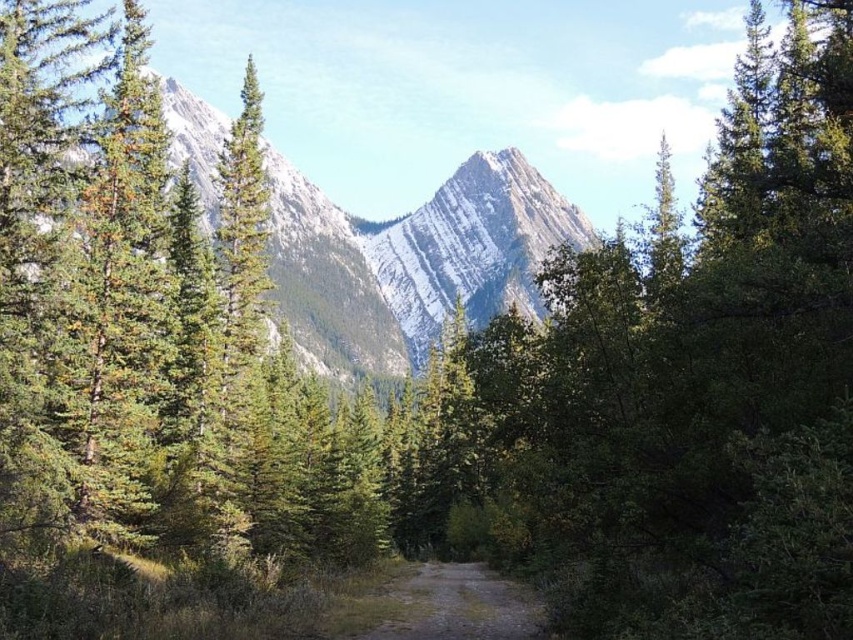
You are standing on the dirt path in the forest and see two points marked on the ground ahead of you. The first point is at coordinates point [364,230] and the second point is at point [378,634]. Which point is closer to your current position?

Point [364,230] is closer to your current position because it is further to the viewer than point [378,634], meaning it is physically nearer to you.

You are planning a hiking trip and see the image. You need to decide if the snowy granite peak at center is wider than the brown dirt path at center. Based on the scene, can you determine this?

The snowy granite peak at center might be wider than brown dirt path at center according to the description.